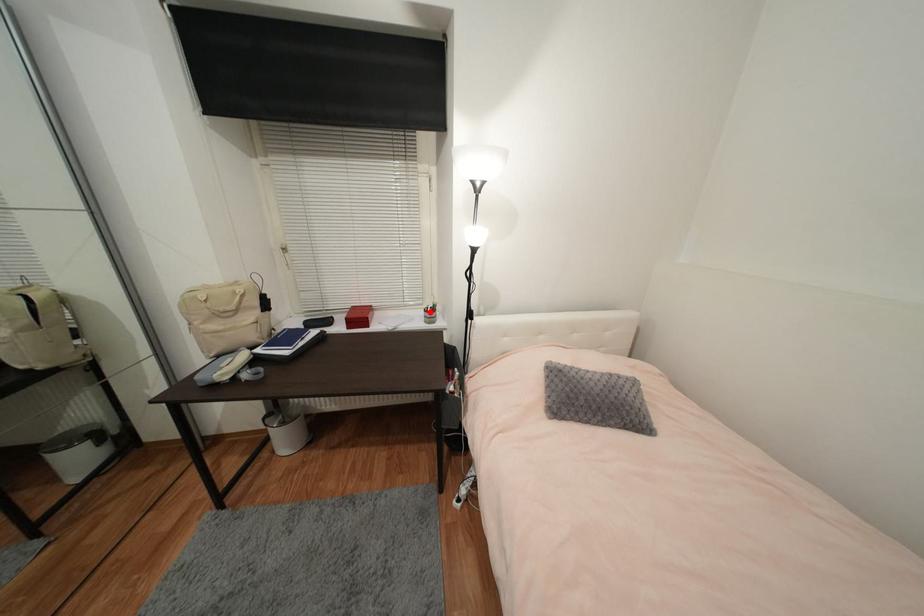
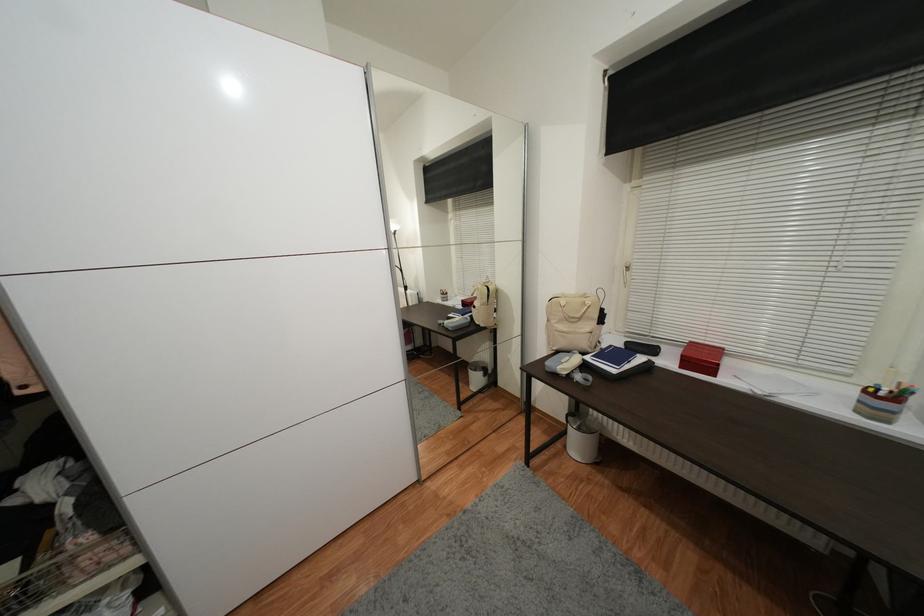
Question: I am providing you with two images of the same scene from different viewpoints. In image1, a red point is highlighted. Considering the same 3D point in image2, which of the following is correct?

Choices:
 (A) It is closer
 (B) It is farther

Answer: (B)